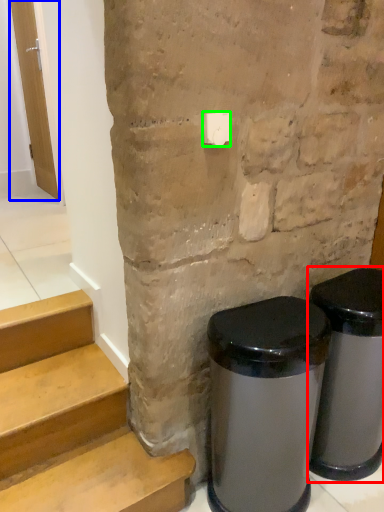
Question: Considering the real-world distances, which object is farthest from waste container (highlighted by a red box)? door (highlighted by a blue box) or light switch (highlighted by a green box)?

Choices:
 (A) door
 (B) light switch

Answer: (A)